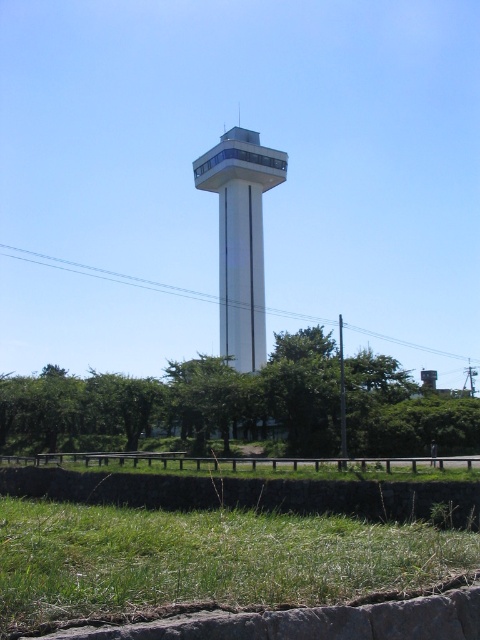
Is green leafy tree at center to the left of white smooth tower at center from the viewer's perspective?

Yes, green leafy tree at center is to the left of white smooth tower at center.

Between point (80, 417) and point (264, 307), which one is positioned behind?

The point (264, 307) is behind.

Where is `green leafy tree at center`? This screenshot has height=640, width=480. green leafy tree at center is located at coordinates (181, 403).